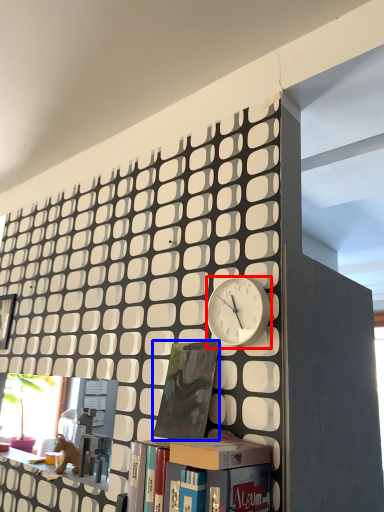
Question: Which point is closer to the camera, clock (highlighted by a red box) or book (highlighted by a blue box)?

Choices:
 (A) clock
 (B) book

Answer: (A)